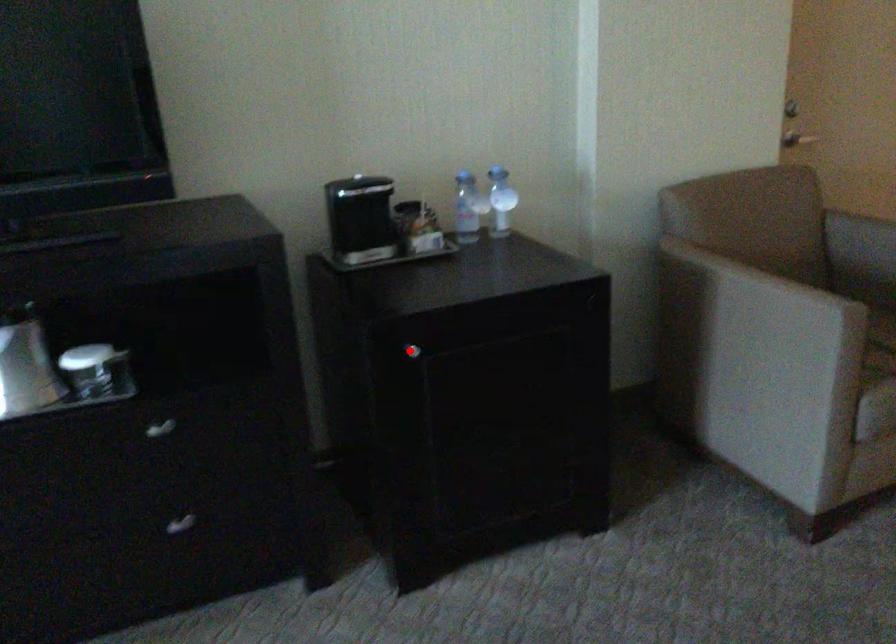
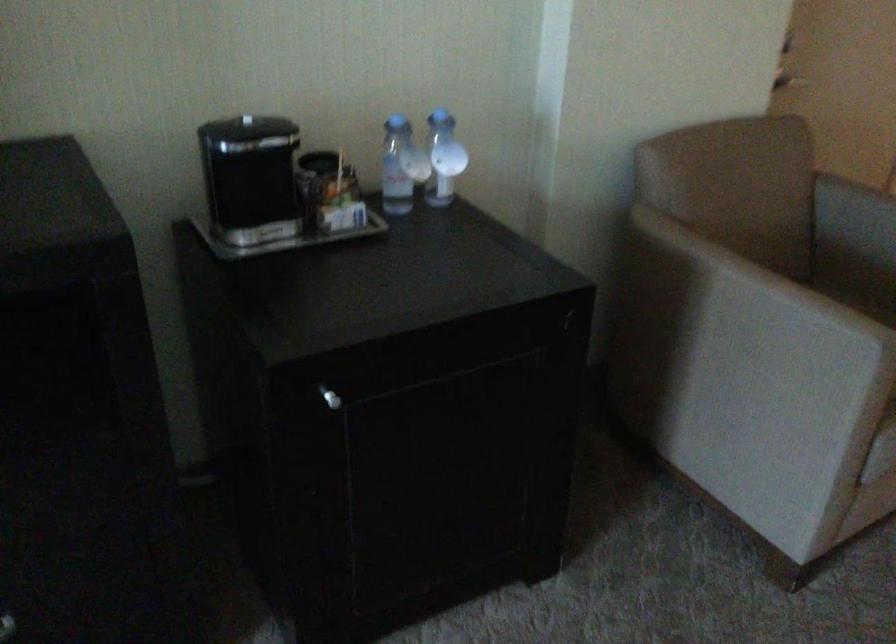
Question: I am providing you with two images of the same scene from different viewpoints. A red point is shown in image1. For the corresponding object point in image2, is it positioned nearer or farther from the camera?

Choices:
 (A) Nearer
 (B) Farther

Answer: (A)